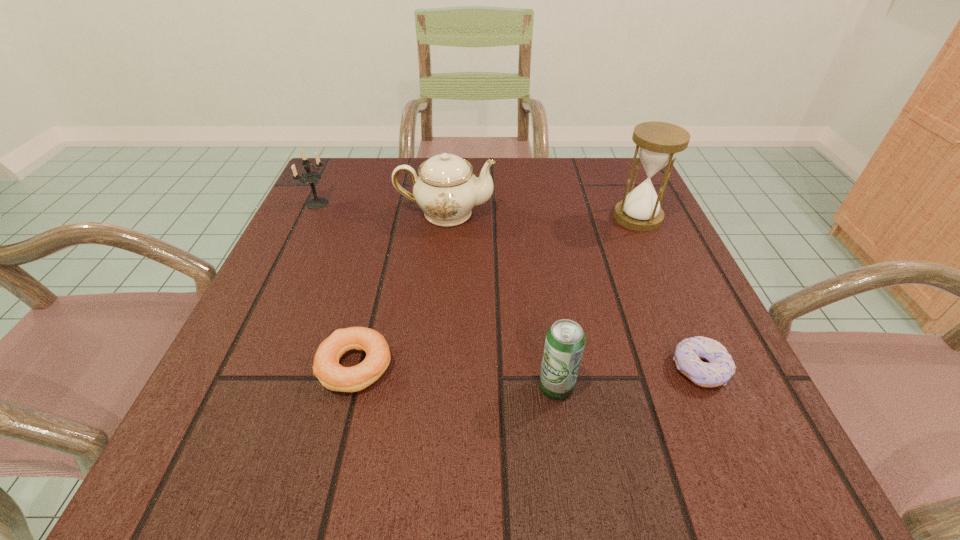
Image resolution: width=960 pixels, height=540 pixels. I want to click on vacant space situated on the right of the bagel, so click(524, 366).

I want to click on vacant space located on the back of the doughnut, so click(x=672, y=306).

The height and width of the screenshot is (540, 960). In order to click on hourglass positioned at the far edge in this screenshot , I will do `click(657, 143)`.

Identify the location of chinaware positioned at the far edge. (446, 189).

Where is `candle holder that is at the far edge`? candle holder that is at the far edge is located at coordinates (309, 176).

Locate an element on the screen. The height and width of the screenshot is (540, 960). candle holder at the left edge is located at coordinates pos(309,176).

What are the coordinates of `bagel that is at the left edge` in the screenshot? It's located at (332, 375).

Locate an element on the screen. This screenshot has width=960, height=540. hourglass positioned at the right edge is located at coordinates (657, 143).

Where is `doughnut that is at the right edge`? Image resolution: width=960 pixels, height=540 pixels. doughnut that is at the right edge is located at coordinates (720, 367).

Identify the location of object situated at the far left corner. (309, 176).